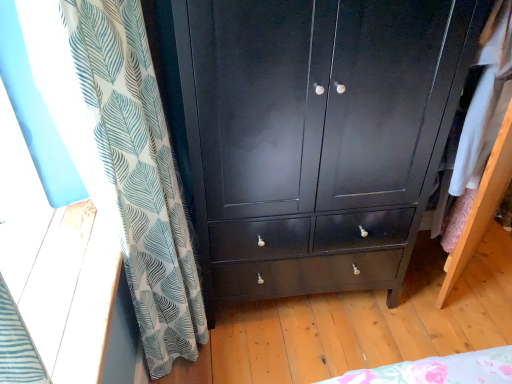
You are a GUI agent. You are given a task and a screenshot of the screen. Output one action in this format:
    pyautogui.click(x=<x>, y=<y>)
    Task: Click on the vacant region below glossy black cabinet at center (from a real-world perspective)
    
    Given the screenshot: What is the action you would take?
    pyautogui.click(x=315, y=311)